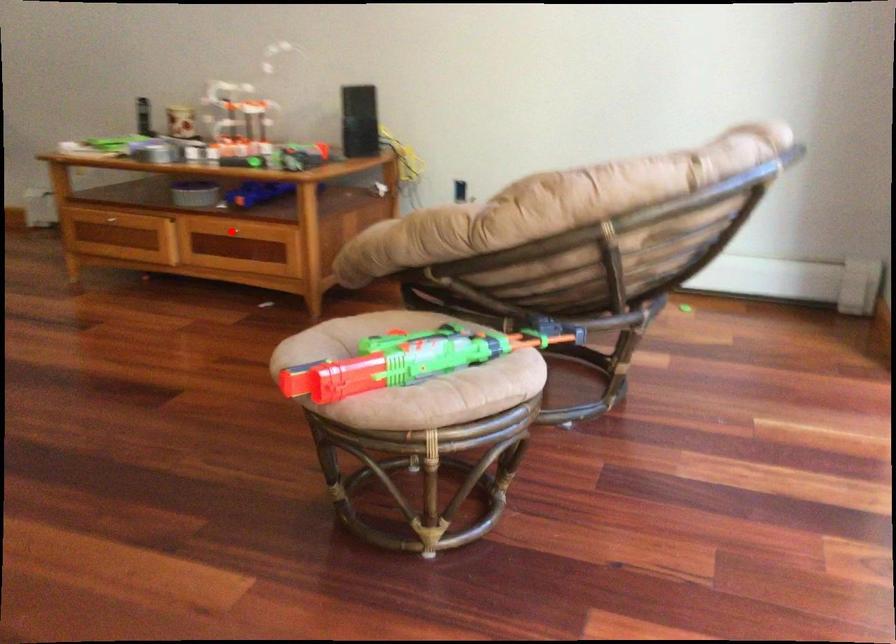
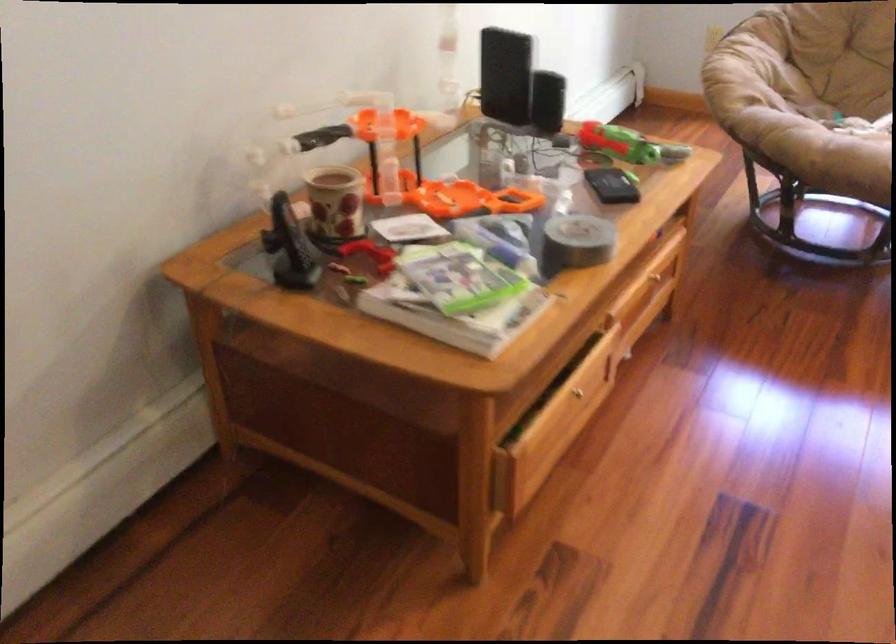
Locate, in the second image, the point that corresponds to the highlighted location in the first image.

(653, 277)